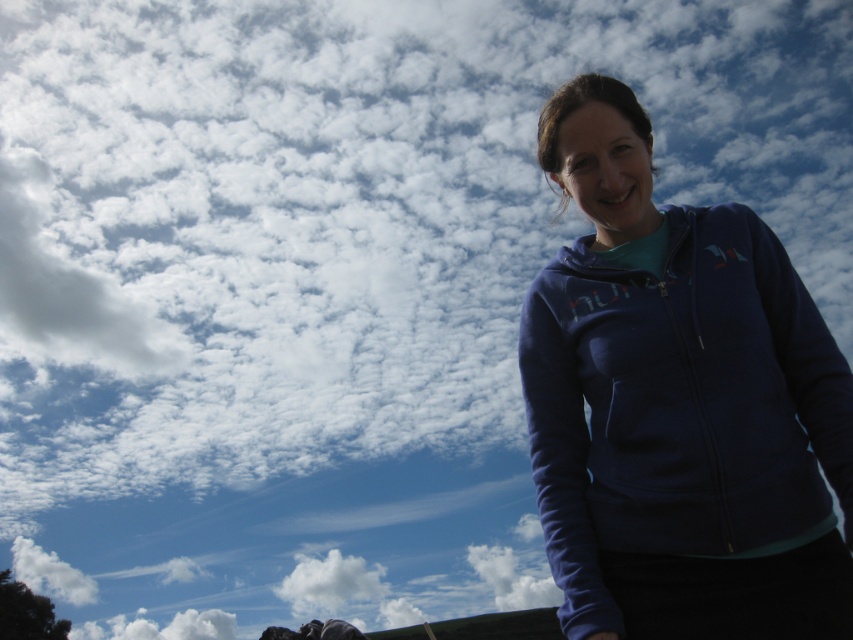
You are a photographer trying to capture a candid shot of the person in the scene. You want to ensure that the focus is sharp on the person while keeping the background slightly blurred. Given the camera settings, the depth of field allows for sharpness within 2.5 meters from the camera. Is the point where the person is standing at point (749, 304) within the depth of field range to be in focus?

The distance of point (749, 304) from the camera is 3.06 meters, which is beyond the 2.5 meters depth of field range. Therefore, the person at that point would not be in focus, resulting in a blurred image.

You are a photographer trying to capture the blue fleece jacket at right and the white fluffy cloud at lower center in the same frame. Which object should you adjust your camera to focus on first if you want to include both in your shot?

You should focus on the white fluffy cloud at lower center first because the blue fleece jacket at right is positioned to the right of it, so adjusting the camera to include the cloud first will allow you to frame both objects properly.

You are a photographer trying to capture the blue fleece jacket at right and the white fluffy cloud at lower center in the same frame. Based on their positions, can you tell which one is higher in the image?

The blue fleece jacket at right is above the white fluffy cloud at lower center, so the blue fleece jacket at right is higher in the image.